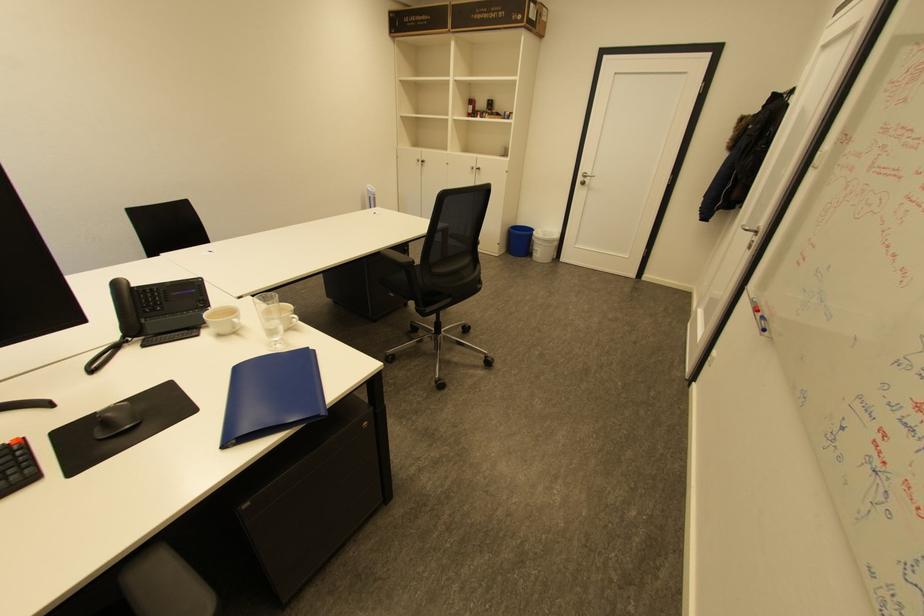
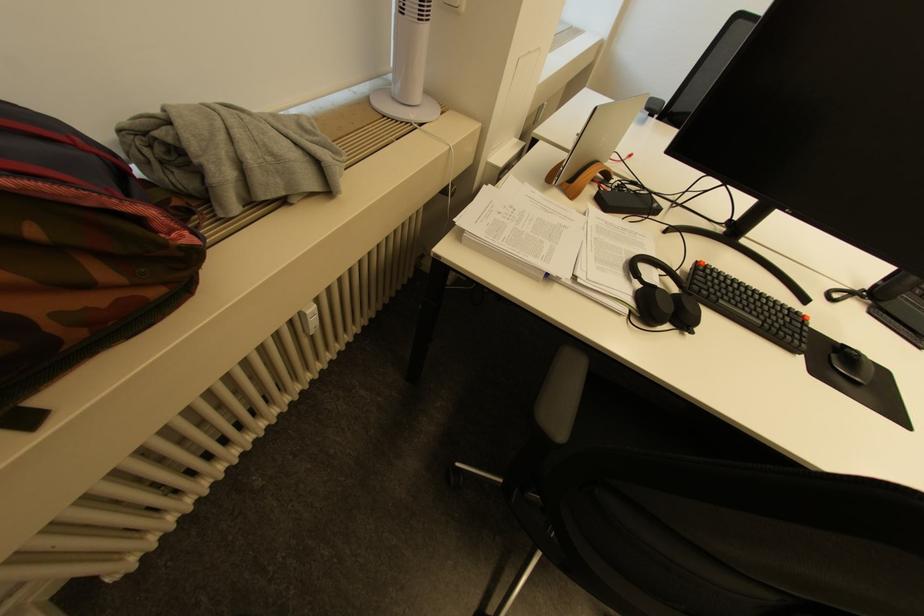
Find the pixel in the second image that matches pixel 134 427 in the first image.

(865, 381)